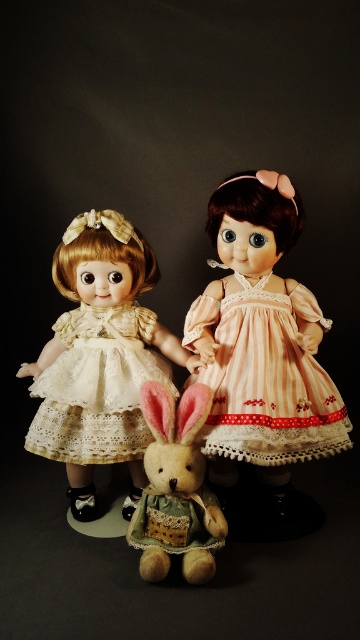
Question: Does matte cream lace dress at center have a greater width compared to pink striped fabric dress at center?

Choices:
 (A) yes
 (B) no

Answer: (A)

Question: Which of the following is the closest to the observer?

Choices:
 (A) (87, 448)
 (B) (132, 308)

Answer: (A)

Question: Which object is closer to the camera taking this photo?

Choices:
 (A) fluffy brown plush at center
 (B) matte cream lace dress at center

Answer: (A)

Question: Can you confirm if matte cream lace dress at center is smaller than white lace dress at left?

Choices:
 (A) no
 (B) yes

Answer: (A)

Question: Which is farther from the pink striped fabric dress at center?

Choices:
 (A) fluffy brown plush at center
 (B) matte cream lace dress at center
 (C) white lace dress at left

Answer: (C)

Question: Can you confirm if matte cream lace dress at center is positioned to the left of white lace dress at left?

Choices:
 (A) yes
 (B) no

Answer: (A)